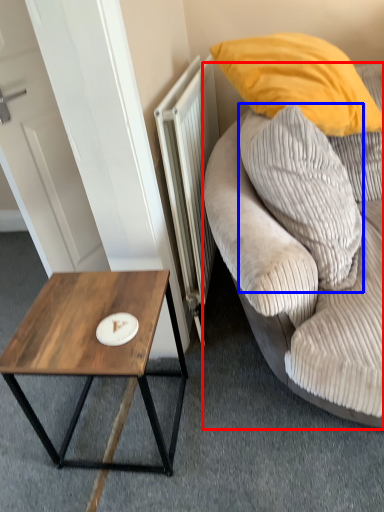
Question: Which object appears closest to the camera in this image, studio couch (highlighted by a red box) or pillow (highlighted by a blue box)?

Choices:
 (A) studio couch
 (B) pillow

Answer: (A)